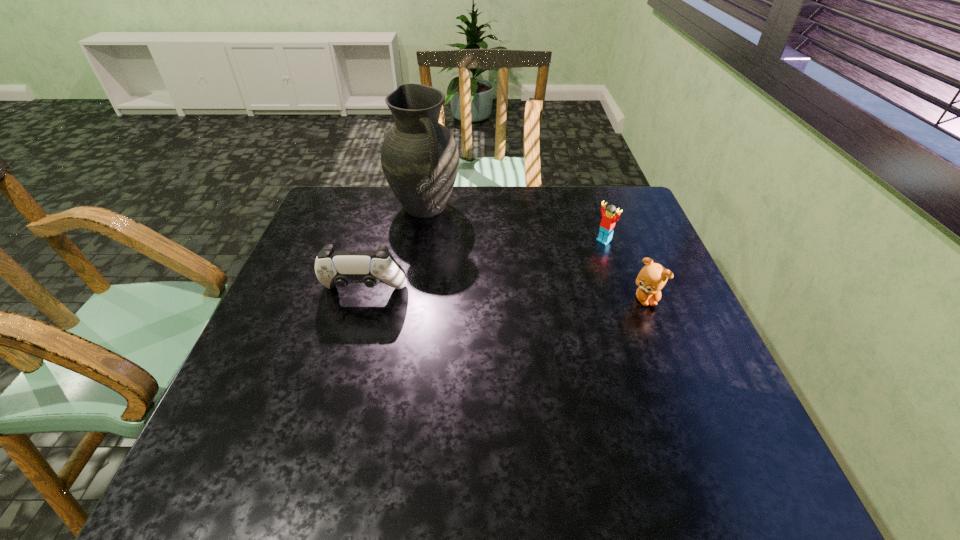
Where is `vacant space situated on the face of the second farthest object`? This screenshot has height=540, width=960. vacant space situated on the face of the second farthest object is located at coordinates (556, 274).

Locate an element on the screen. The height and width of the screenshot is (540, 960). vacant space located 0.170m on the face of the second farthest object is located at coordinates (561, 271).

You are a GUI agent. You are given a task and a screenshot of the screen. Output one action in this format:
    pyautogui.click(x=<x>, y=<y>)
    Task: Click on the vacant space located on the face of the second farthest object
    
    Given the screenshot: What is the action you would take?
    pyautogui.click(x=570, y=264)

You are a GUI agent. You are given a task and a screenshot of the screen. Output one action in this format:
    pyautogui.click(x=<x>, y=<y>)
    Task: Click on the object that is at the far edge
    
    Given the screenshot: What is the action you would take?
    pyautogui.click(x=419, y=156)

The width and height of the screenshot is (960, 540). I want to click on object located at the left edge, so click(341, 268).

The width and height of the screenshot is (960, 540). In order to click on teddy bear at the right edge in this screenshot , I will do `click(652, 278)`.

The image size is (960, 540). In order to click on Lego that is at the right edge in this screenshot , I will do `click(607, 225)`.

Locate an element on the screen. The width and height of the screenshot is (960, 540). vacant space at the far edge is located at coordinates (571, 211).

This screenshot has width=960, height=540. In order to click on free space at the left edge of the desktop in this screenshot , I will do `click(252, 362)`.

In the image, there is a desktop. Where is `vacant space at the right edge`? vacant space at the right edge is located at coordinates (623, 232).